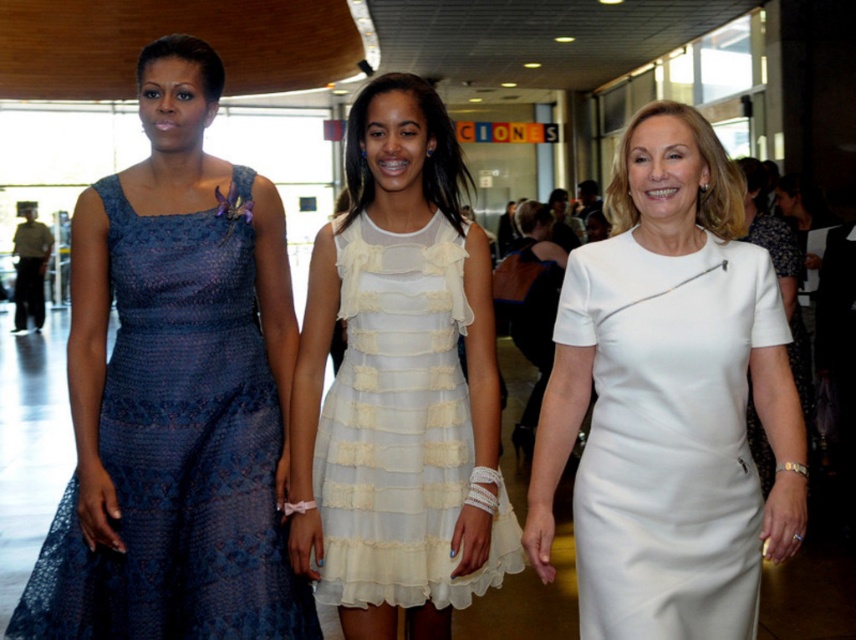
Question: Which point is farther to the camera?

Choices:
 (A) (791, 365)
 (B) (149, 460)

Answer: (A)

Question: Does lace dress at left appear under white satin dress at center?

Choices:
 (A) no
 (B) yes

Answer: (B)

Question: Is white smooth dress at center thinner than lace dress at left?

Choices:
 (A) no
 (B) yes

Answer: (B)

Question: Is white smooth dress at center wider than white satin dress at center?

Choices:
 (A) yes
 (B) no

Answer: (A)

Question: Among these points, which one is nearest to the camera?

Choices:
 (A) (407, 312)
 (B) (765, 212)
 (C) (733, 312)

Answer: (C)

Question: Which point is farther to the camera?

Choices:
 (A) (718, 436)
 (B) (129, 236)
 (C) (780, 278)
 (D) (408, 326)

Answer: (C)